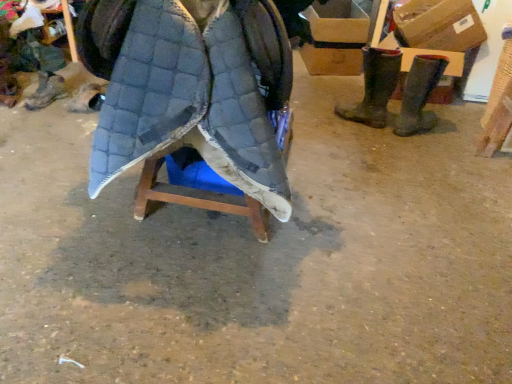
Question: Would you say brown rubber boots at right, arranged as the second footwear when viewed from the right, is inside or outside cardboard box at upper right, arranged as the second cardboard box when viewed from the front?

Choices:
 (A) inside
 (B) outside

Answer: (B)

Question: In the image, is brown rubber boots at right, arranged as the second footwear when viewed from the right, positioned in front of or behind cardboard box at upper right, positioned as the first cardboard box in left-to-right order?

Choices:
 (A) front
 (B) behind

Answer: (A)

Question: Based on their relative distances, which object is farther from the cardboard box at upper right, arranged as the second cardboard box when viewed from the front?

Choices:
 (A) brown suede boots at right, acting as the fourth footwear starting from the left
 (B) matte black boot at center, which is the 2th footwear in left-to-right order
 (C) quilted fabric cloak at center
 (D) brown rubber boots at right, arranged as the second footwear when viewed from the right
 (E) leather boot at lower left, the first footwear from the left

Answer: (C)

Question: Which object is the closest to the matte black boot at center, which is the 2th footwear in left-to-right order?

Choices:
 (A) leather boot at lower left, the first footwear from the left
 (B) quilted fabric cloak at center
 (C) brown suede boots at right, acting as the fourth footwear starting from the left
 (D) cardboard box at upper right, positioned as the first cardboard box in left-to-right order
 (E) brown rubber boots at right, the 3th footwear from the left

Answer: (A)